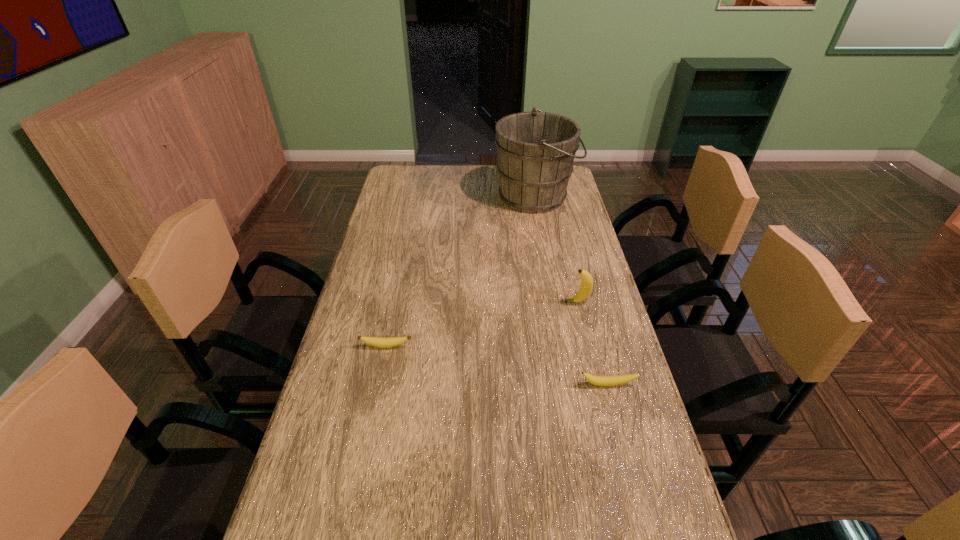
The height and width of the screenshot is (540, 960). In order to click on unoccupied area between the nearest banana and the tallest object in this screenshot , I will do `click(571, 291)`.

Where is `the second closest object to the tallest object`? the second closest object to the tallest object is located at coordinates (381, 342).

I want to click on the second closest object relative to the second shortest object, so click(381, 342).

Locate which banana ranks in proximity to the third nearest object. Please provide its 2D coordinates. Your answer should be formatted as a tuple, i.e. [(x, y)], where the tuple contains the x and y coordinates of a point satisfying the conditions above.

[(595, 380)]

Locate an element on the screen. the closest banana relative to the leftmost banana is located at coordinates (595, 380).

Locate an element on the screen. The height and width of the screenshot is (540, 960). blank area in the image that satisfies the following two spatial constraints: 1. on the handle side of the farthest object; 2. on the front side of the leftmost banana is located at coordinates (563, 346).

At what (x,y) coordinates should I click in order to perform the action: click on free spot that satisfies the following two spatial constraints: 1. from the stem of the second farthest object; 2. on the front side of the shortest banana. Please return your answer as a coordinate pair (x, y). Looking at the image, I should click on (588, 346).